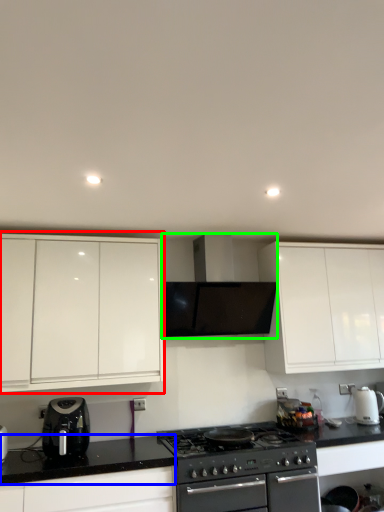
Question: Estimate the real-world distances between objects in this image. Which object is closer to cabinetry (highlighted by a red box), counter top (highlighted by a blue box) or home appliance (highlighted by a green box)?

Choices:
 (A) counter top
 (B) home appliance

Answer: (B)